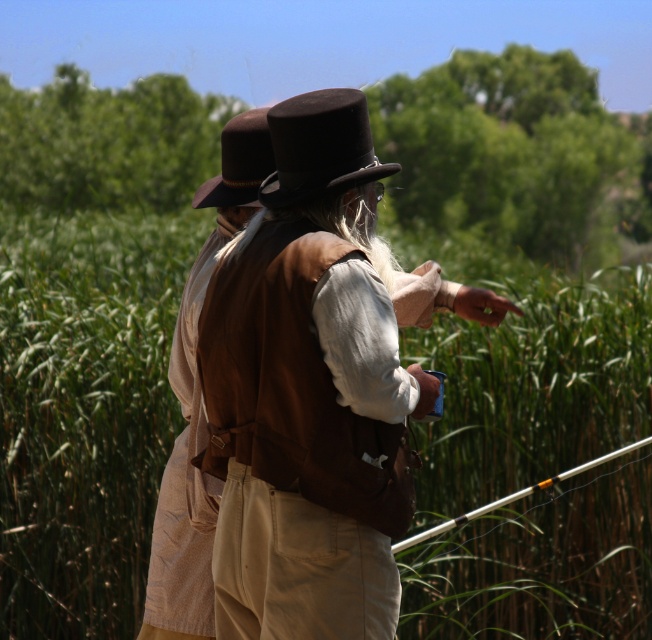
Is matte brown hat at center bigger than brown felt hat at upper center?

Indeed, matte brown hat at center has a larger size compared to brown felt hat at upper center.

Can you confirm if matte brown hat at center is positioned above brown felt hat at upper center?

Actually, matte brown hat at center is below brown felt hat at upper center.

This screenshot has height=640, width=652. I want to click on matte brown hat at center, so click(x=319, y=147).

Image resolution: width=652 pixels, height=640 pixels. Find the location of `matte brown hat at center`. matte brown hat at center is located at coordinates (319, 147).

Does green grass at center have a greater height compared to brown felt hat at upper center?

Yes.

Which is in front, point (649, 573) or point (196, 195)?

Point (196, 195) is more forward.

Does point (110, 381) come in front of point (244, 150)?

That is False.

You are a GUI agent. You are given a task and a screenshot of the screen. Output one action in this format:
    pyautogui.click(x=<x>, y=<y>)
    Task: Click on the green grass at center
    The height and width of the screenshot is (640, 652).
    Given the screenshot: What is the action you would take?
    pyautogui.click(x=83, y=412)

Can you confirm if matte brown hat at center is bigger than metallic silver fishing pole at right?

Incorrect, matte brown hat at center is not larger than metallic silver fishing pole at right.

Who is more forward, (393, 172) or (599, 464)?

Point (393, 172) is more forward.

Is point (359, 118) behind point (408, 547)?

No, (359, 118) is closer to viewer.

Find the location of a particular element. matte brown hat at center is located at coordinates (319, 147).